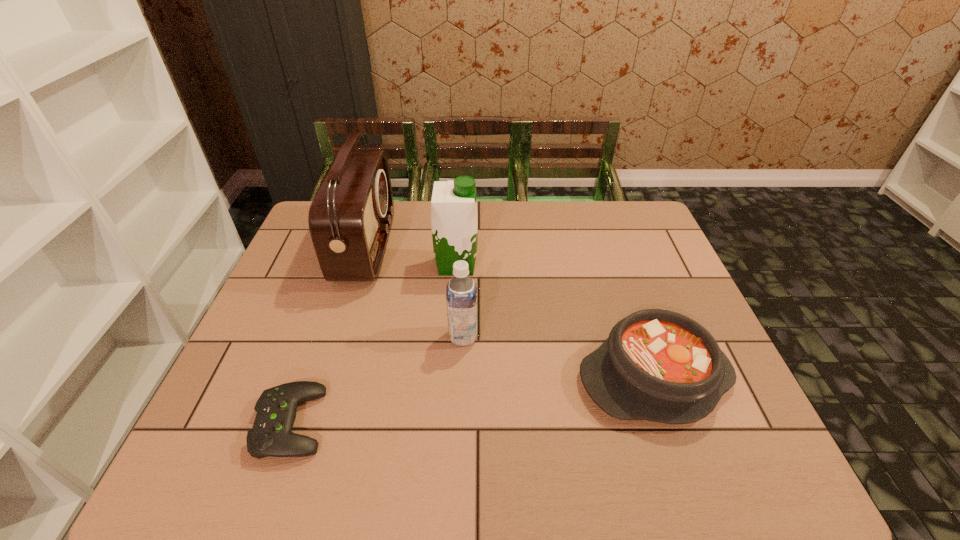
At what (x,y) coordinates should I click in order to perform the action: click on vacant space that satisfies the following two spatial constraints: 1. on the front panel of the casserole; 2. on the right side of the radio receiver. Please return your answer as a coordinate pair (x, y). Image resolution: width=960 pixels, height=540 pixels. Looking at the image, I should click on (325, 378).

Where is `blank area in the image that satisfies the following two spatial constraints: 1. on the label of the third tallest object; 2. on the back side of the rightmost object`? This screenshot has height=540, width=960. blank area in the image that satisfies the following two spatial constraints: 1. on the label of the third tallest object; 2. on the back side of the rightmost object is located at coordinates (462, 378).